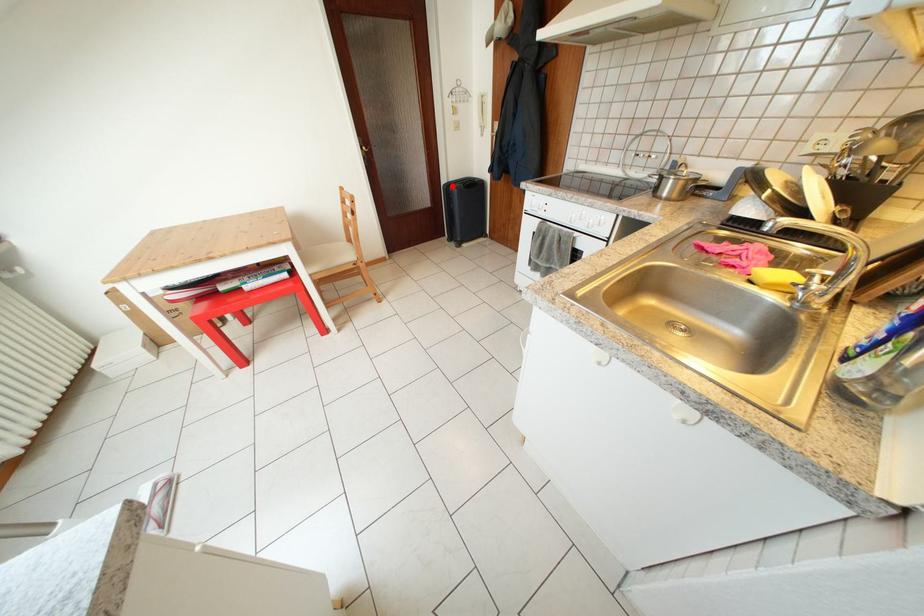
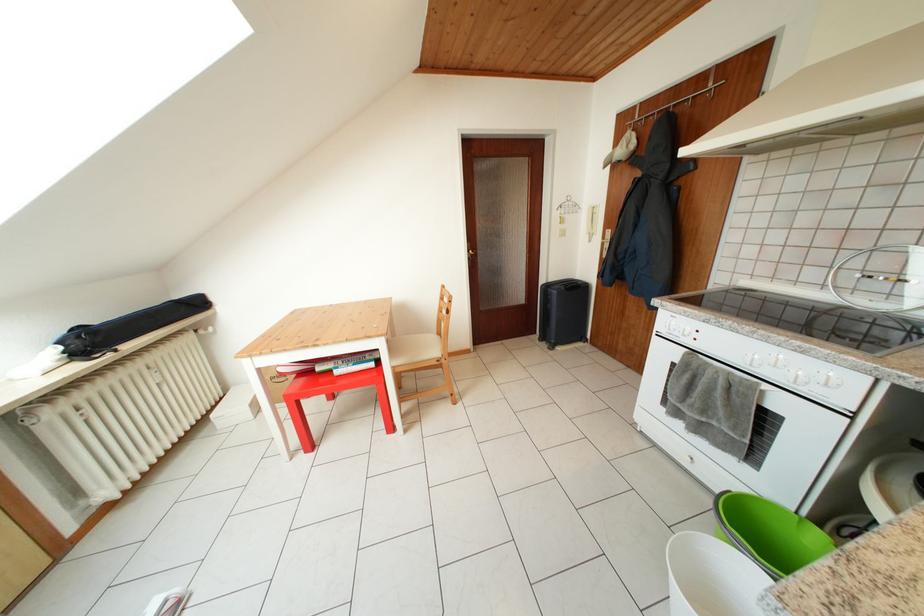
Find the pixel in the second image that matches the highlighted location in the first image.

(551, 286)